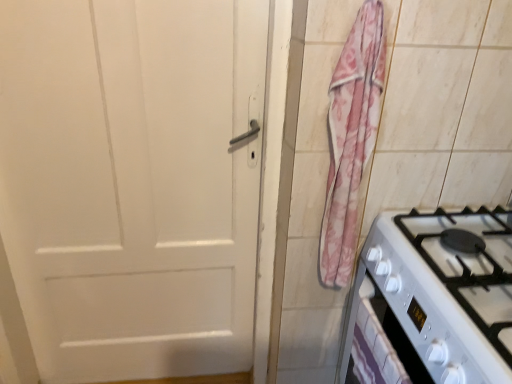
What is the approximate height of white glossy gas stove at lower right?

The height of white glossy gas stove at lower right is 8.71 inches.

At what (x,y) coordinates should I click in order to perform the action: click on white glossy drawer at lower right. Please return your answer as a coordinate pair (x, y). The height and width of the screenshot is (384, 512). Looking at the image, I should click on (374, 351).

Between point (375, 315) and point (335, 222), which one is positioned in front?

The point (375, 315) is more forward.

From a real-world perspective, is white glossy drawer at lower right under pink floral fabric at right?

Yes, from a real-world perspective, white glossy drawer at lower right is below pink floral fabric at right.

Which object is thinner, white glossy drawer at lower right or pink floral fabric at right?

white glossy drawer at lower right.

Considering the relative sizes of pink floral fabric at right and white glossy drawer at lower right in the image provided, is pink floral fabric at right shorter than white glossy drawer at lower right?

No, pink floral fabric at right is not shorter than white glossy drawer at lower right.

From a real-world perspective, which object stands above the other?

pink floral fabric at right is physically above.

From the image's perspective, is pink floral fabric at right positioned above or below white glossy drawer at lower right?

From the image's perspective, pink floral fabric at right appears above white glossy drawer at lower right.

From the image's perspective, who appears lower, white glossy drawer at lower right or white glossy gas stove at lower right?

white glossy drawer at lower right appears lower in the image.

Locate an element on the screen. The height and width of the screenshot is (384, 512). drawer located on the left of white glossy gas stove at lower right is located at coordinates (374, 351).

From a real-world perspective, between white glossy drawer at lower right and white glossy gas stove at lower right, who is vertically higher?

white glossy gas stove at lower right.

From the image's perspective, would you say pink floral fabric at right is positioned over white glossy gas stove at lower right?

Yes, from the image's perspective, pink floral fabric at right is above white glossy gas stove at lower right.

Is white glossy gas stove at lower right completely or partially inside pink floral fabric at right?

No, white glossy gas stove at lower right is not surrounded by pink floral fabric at right.

Could you tell me if pink floral fabric at right is facing white glossy gas stove at lower right?

No, pink floral fabric at right does not turn towards white glossy gas stove at lower right.

Considering the positions of objects pink floral fabric at right and white glossy gas stove at lower right in the image provided, who is more to the left, pink floral fabric at right or white glossy gas stove at lower right?

Positioned to the left is pink floral fabric at right.

Is white glossy gas stove at lower right not inside pink floral fabric at right?

Yes.

How distant is white glossy gas stove at lower right from pink floral fabric at right?

white glossy gas stove at lower right is 11.75 inches from pink floral fabric at right.

Is white glossy gas stove at lower right positioned with its back to pink floral fabric at right?

That's not correct — white glossy gas stove at lower right is not looking away from pink floral fabric at right.

From a real-world perspective, is white glossy gas stove at lower right located higher than pink floral fabric at right?

Incorrect, from a real-world perspective, white glossy gas stove at lower right is lower than pink floral fabric at right.

Considering the points (411, 240) and (362, 323), which point is in front, point (411, 240) or point (362, 323)?

The point (362, 323) is closer.

Is white glossy gas stove at lower right oriented towards white glossy drawer at lower right?

No, white glossy gas stove at lower right is not aimed at white glossy drawer at lower right.

Can you tell me how much white glossy gas stove at lower right and white glossy drawer at lower right differ in facing direction?

0.00725 degrees separate the facing orientations of white glossy gas stove at lower right and white glossy drawer at lower right.

From a real-world perspective, is white glossy gas stove at lower right physically located above or below white glossy drawer at lower right?

white glossy gas stove at lower right is above white glossy drawer at lower right.

I want to click on curtain on the left of white glossy drawer at lower right, so click(x=351, y=139).

The width and height of the screenshot is (512, 384). Identify the location of drawer below the pink floral fabric at right (from the image's perspective). (374, 351).

When comparing their distances from white glossy gas stove at lower right, does white glossy drawer at lower right or pink floral fabric at right seem closer?

white glossy drawer at lower right is positioned closer to the anchor white glossy gas stove at lower right.

When comparing their distances from white glossy drawer at lower right, does pink floral fabric at right or white glossy gas stove at lower right seem closer?

white glossy gas stove at lower right lies closer to white glossy drawer at lower right than the other object.

Based on their spatial positions, is pink floral fabric at right or white glossy drawer at lower right further from white glossy gas stove at lower right?

The object further to white glossy gas stove at lower right is pink floral fabric at right.

Considering their positions, is white glossy drawer at lower right positioned closer to pink floral fabric at right than white glossy gas stove at lower right?

white glossy gas stove at lower right is closer to pink floral fabric at right.

Considering their positions, is white glossy gas stove at lower right positioned further to white glossy drawer at lower right than pink floral fabric at right?

pink floral fabric at right lies further to white glossy drawer at lower right than the other object.

Based on their spatial positions, is white glossy gas stove at lower right or white glossy drawer at lower right closer to pink floral fabric at right?

Based on the image, white glossy gas stove at lower right appears to be nearer to pink floral fabric at right.

What are the coordinates of `gas stove between pink floral fabric at right and white glossy drawer at lower right in the up-down direction` in the screenshot? It's located at (470, 264).